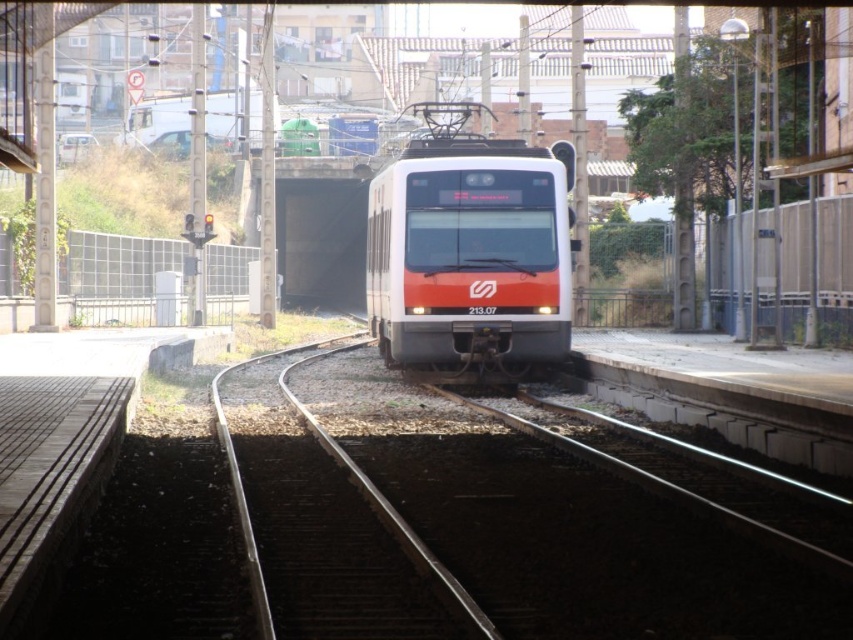
You are a railway engineer assessing the scene. You notice the metallic rail at center and the white glossy passenger train at center. Which object appears smaller in the image?

The metallic rail at center appears smaller than the white glossy passenger train at center.

You are a maintenance worker checking the tracks. You notice the metallic rail at center and the metal at center. Which one is directly above the other?

The metal at center is directly above the metallic rail at center because the metallic rail at center is positioned under metal at center.

You are standing on the platform and want to walk from point (567, 493) to point (469, 234). Which direction should you move to get closer to the tunnel entrance?

You should move towards point (469, 234) because it is farther from the viewer and closer to the tunnel entrance, which is behind the train.